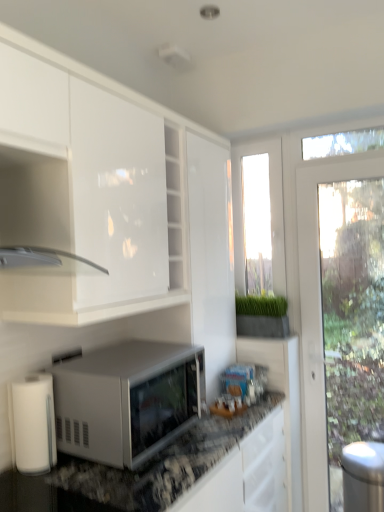
Question: Considering the positions of matte white cabinet at upper left and white matte microwave at center in the image, is matte white cabinet at upper left wider or thinner than white matte microwave at center?

Choices:
 (A) wide
 (B) thin

Answer: (B)

Question: Is point (3, 264) closer or farther from the camera than point (182, 360)?

Choices:
 (A) closer
 (B) farther

Answer: (A)

Question: Based on their relative distances, which object is nearer to the clear glass window screen at upper right, which is the second window screen in left-to-right order?

Choices:
 (A) stainless steel trash can at right
 (B) white matte paper towel at lower left
 (C) white matte microwave at center
 (D) transparent glass window at center, which is counted as the 2th window screen, starting from the right
 (E) matte white cabinet at upper left

Answer: (D)

Question: Which object is the farthest from the white matte paper towel at lower left?

Choices:
 (A) clear glass window screen at upper right, the 1th window screen in the right-to-left sequence
 (B) transparent glass window at center, which is counted as the 2th window screen, starting from the right
 (C) white matte microwave at center
 (D) stainless steel trash can at right
 (E) matte white cabinet at upper left

Answer: (A)